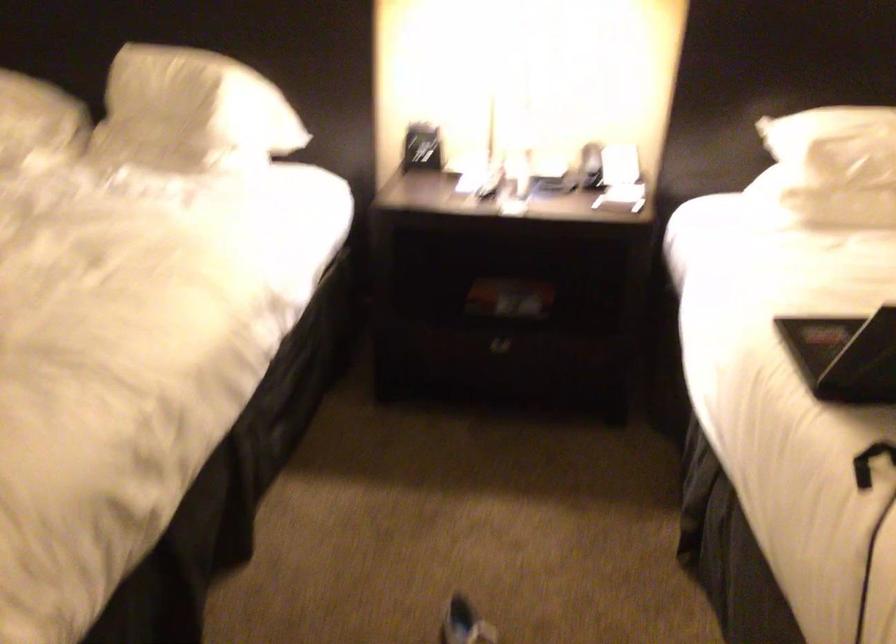
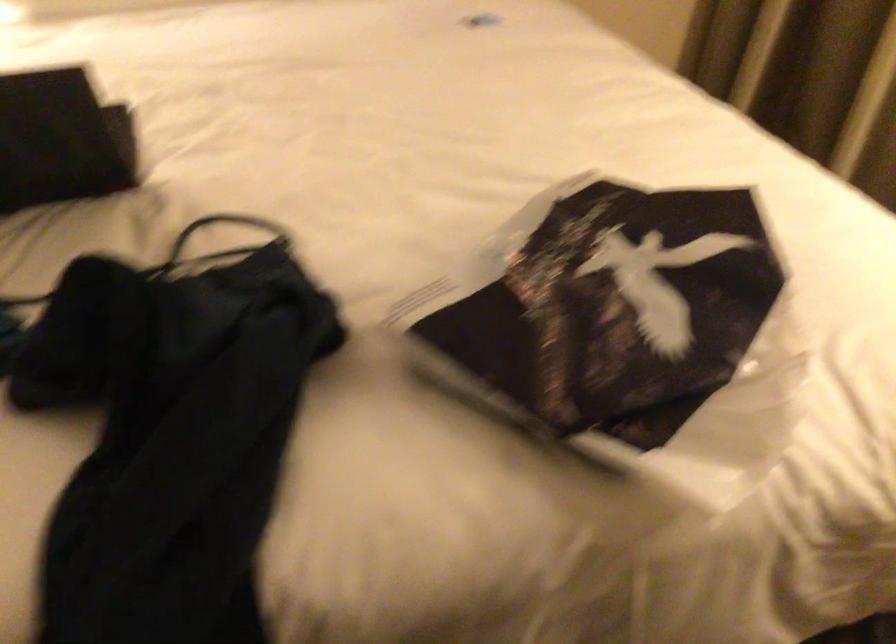
Question: The images are taken continuously from a first-person perspective. In which direction is your viewpoint rotating?

Choices:
 (A) Left
 (B) Right
 (C) Up
 (D) Down

Answer: (B)